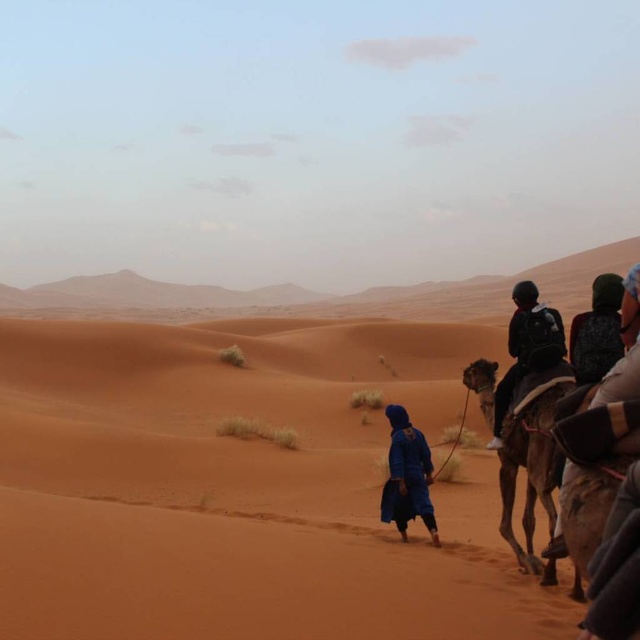
Is dark blue fabric at right smaller than dark green fabric backpack at right?

Yes.

Who is more forward, (515, 349) or (596, 355)?

Point (596, 355) is in front.

The image size is (640, 640). I want to click on dark blue fabric at right, so click(x=525, y=348).

Does brown textured camel at right appear under blue woolen robe at center?

Indeed, brown textured camel at right is positioned under blue woolen robe at center.

Based on the photo, does brown textured camel at right come in front of blue woolen robe at center?

Yes, brown textured camel at right is closer to the viewer.

Which is behind, point (547, 416) or point (400, 465)?

Point (400, 465)

This screenshot has height=640, width=640. Identify the location of brown textured camel at right. (531, 461).

Is sandy/desert-like at center below blue woolen robe at center?

No.

From the picture: Between sandy/desert-like at center and blue woolen robe at center, which one has more height?

sandy/desert-like at center is taller.

Image resolution: width=640 pixels, height=640 pixels. I want to click on sandy/desert-like at center, so click(241, 490).